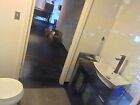
Look for where you'd turn on the faucet in the image and show me where they are. Your answer should be formatted as a list of tuples, i.e. [(x1, y1), (x2, y2), ...], where each tuple contains the x and y coordinates of a point satisfying the conditions above.

[(122, 55)]